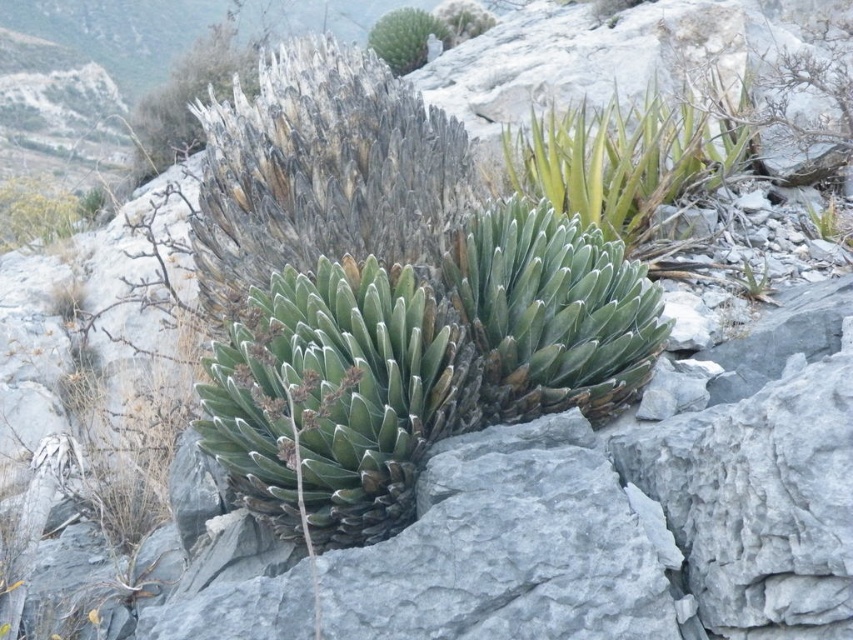
Which is below, green leafy plant at upper right or green succulent at upper center?

green leafy plant at upper right

Can you confirm if green leafy plant at upper right is wider than green succulent at upper center?

Yes, green leafy plant at upper right is wider than green succulent at upper center.

Between point (573, 161) and point (401, 67), which one is positioned behind?

Positioned behind is point (401, 67).

Where is `green leafy plant at upper right`? The image size is (853, 640). green leafy plant at upper right is located at coordinates (631, 157).